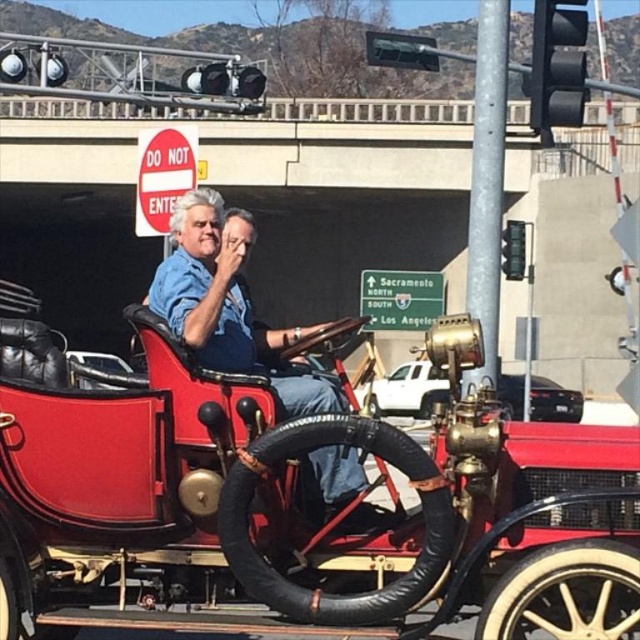
Question: Is concrete bridge at upper center wider than red leather seat at center?

Choices:
 (A) no
 (B) yes

Answer: (B)

Question: Among these points, which one is farthest from the camera?

Choices:
 (A) (99, 385)
 (B) (208, 260)
 (C) (604, 168)
 (D) (540, 381)

Answer: (C)

Question: Which point is farther from the camera taking this photo?

Choices:
 (A) (129, 372)
 (B) (416, 392)
 (C) (305, 113)

Answer: (C)

Question: Which object is farther from the camera taking this photo?

Choices:
 (A) polished brass engine at center
 (B) matte blue shirt at center

Answer: (A)

Question: Does concrete bridge at upper center appear on the left side of polished brass engine at center?

Choices:
 (A) yes
 (B) no

Answer: (A)

Question: Does polished brass engine at center lie in front of red leather seat at center?

Choices:
 (A) yes
 (B) no

Answer: (A)